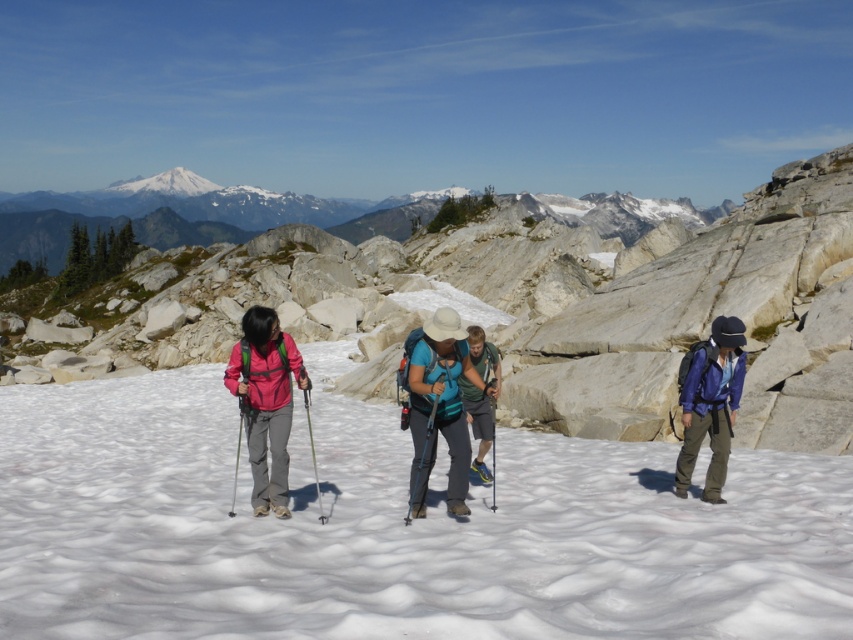
You are a hiker standing at the viewpoint and want to know how far the point at coordinates point [589,272] is from you. Can you determine the distance?

The distance between point [589,272] and the viewer is 122.10 meters.

From the picture: You are a hiker trying to navigate the snowy mountain trail. You see the white rocky mountain at center and the black plastic ski pole at center. Which object is located to the right of the other?

The white rocky mountain at center is positioned on the right side of black plastic ski pole at center, so the white rocky mountain at center is to the right of the black plastic ski pole at center.